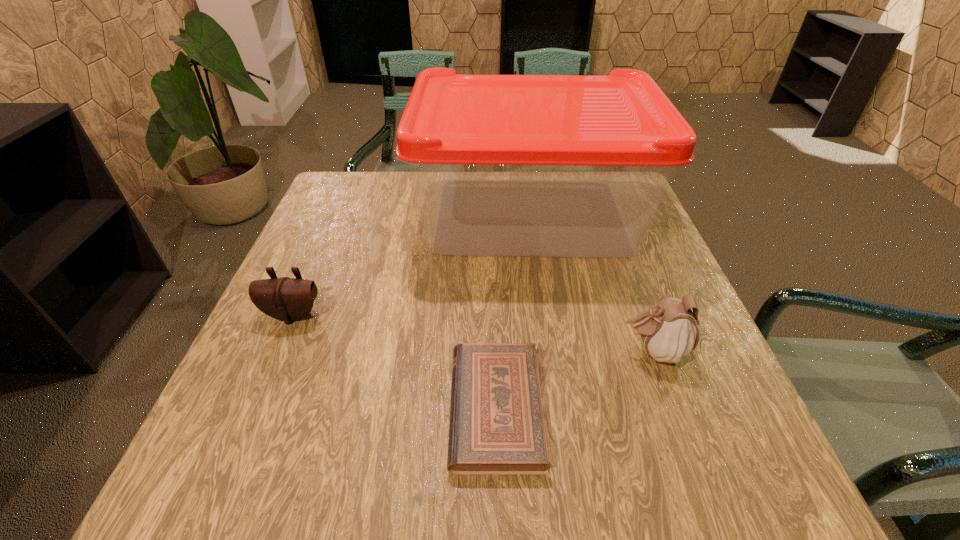
Where is `empty space between the right pouch and the shortest object`? The height and width of the screenshot is (540, 960). empty space between the right pouch and the shortest object is located at coordinates (574, 380).

The width and height of the screenshot is (960, 540). In order to click on free point between the third shortest object and the farther pouch in this screenshot , I will do click(473, 333).

Find the location of `vacant area that lies between the nearer pouch and the farthest object`. vacant area that lies between the nearer pouch and the farthest object is located at coordinates (591, 283).

What are the coordinates of `empty location between the farther pouch and the right pouch` in the screenshot? It's located at (473, 333).

Where is `free spot between the Bible and the nearer pouch`? Image resolution: width=960 pixels, height=540 pixels. free spot between the Bible and the nearer pouch is located at coordinates (574, 380).

Find the location of `blank region between the shortest object and the tallest object`. blank region between the shortest object and the tallest object is located at coordinates (513, 312).

Identify which object is located as the second nearest to the tallest object. Please provide its 2D coordinates. Your answer should be formatted as a tuple, i.e. [(x, y)], where the tuple contains the x and y coordinates of a point satisfying the conditions above.

[(288, 299)]

Select which object appears as the closest to the shorter pouch. Please provide its 2D coordinates. Your answer should be formatted as a tuple, i.e. [(x, y)], where the tuple contains the x and y coordinates of a point satisfying the conditions above.

[(503, 165)]